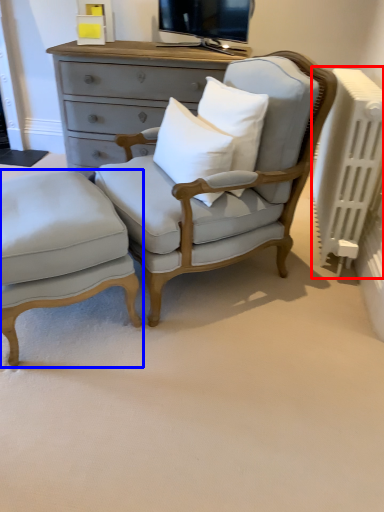
Question: Which object appears farthest to the camera in this image, radiator (highlighted by a red box) or nightstand (highlighted by a blue box)?

Choices:
 (A) radiator
 (B) nightstand

Answer: (A)